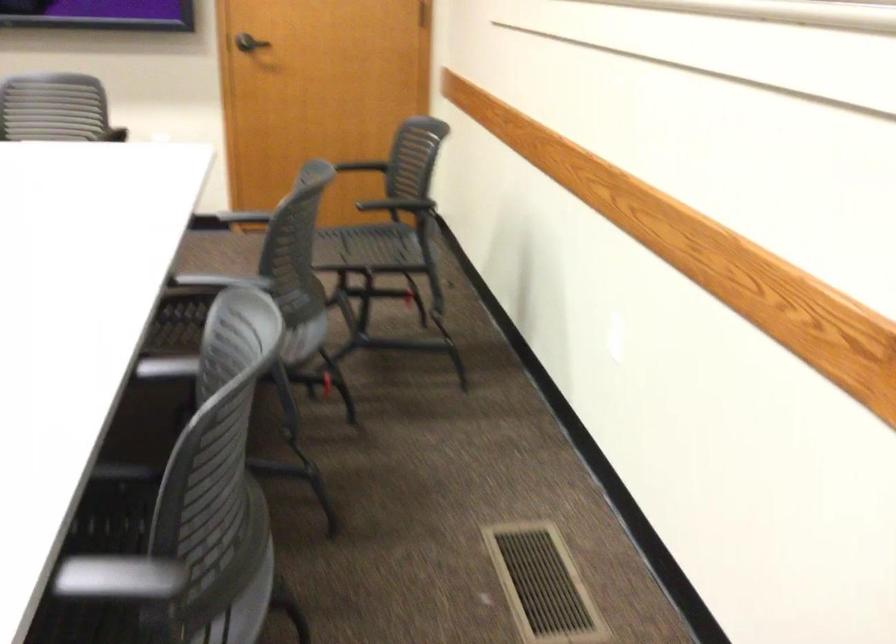
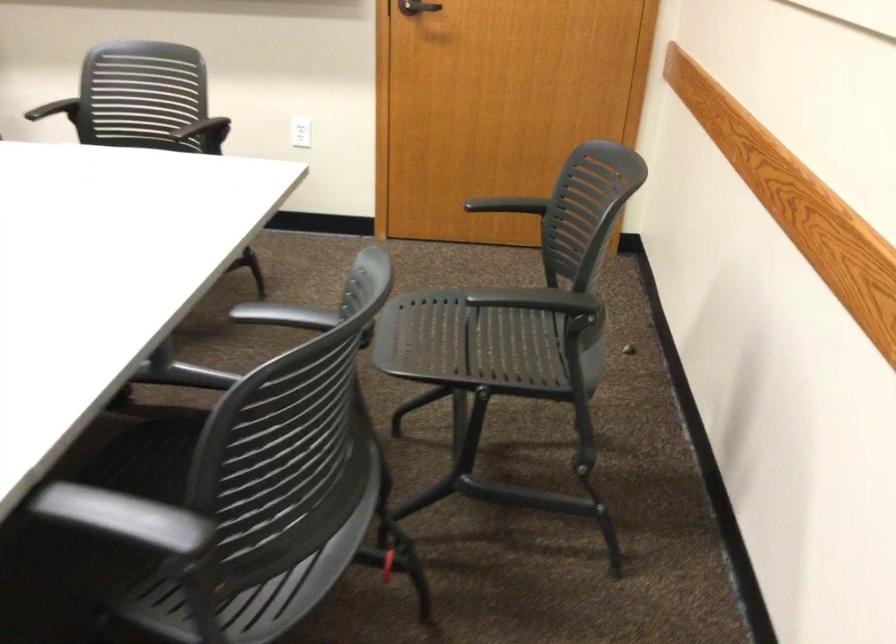
Question: The camera is either moving clockwise (left) or counter-clockwise (right) around the object. The first image is from the beginning of the video and the second image is from the end. Is the camera moving left or right when shooting the video?

Choices:
 (A) Left
 (B) Right

Answer: (B)